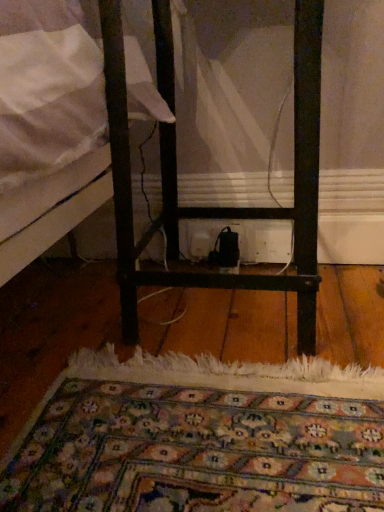
Question: Can you confirm if black metal nightstand at center is bigger than white plastic electric outlet at center?

Choices:
 (A) yes
 (B) no

Answer: (A)

Question: Does black metal nightstand at center have a greater width compared to white plastic electric outlet at center?

Choices:
 (A) no
 (B) yes

Answer: (B)

Question: Is black metal nightstand at center surrounding white plastic electric outlet at center?

Choices:
 (A) yes
 (B) no

Answer: (A)

Question: Is black metal nightstand at center shorter than white plastic electric outlet at center?

Choices:
 (A) yes
 (B) no

Answer: (B)

Question: Considering the relative positions of black metal nightstand at center and white plastic electric outlet at center in the image provided, is black metal nightstand at center in front of white plastic electric outlet at center?

Choices:
 (A) no
 (B) yes

Answer: (B)

Question: Is there a large distance between black metal nightstand at center and white plastic electric outlet at center?

Choices:
 (A) no
 (B) yes

Answer: (A)

Question: From a real-world perspective, is carpeted rug at center physically below black metal nightstand at center?

Choices:
 (A) no
 (B) yes

Answer: (B)

Question: Does carpeted rug at center come behind black metal nightstand at center?

Choices:
 (A) no
 (B) yes

Answer: (A)

Question: Does carpeted rug at center come in front of black metal nightstand at center?

Choices:
 (A) no
 (B) yes

Answer: (B)

Question: Is carpeted rug at center next to black metal nightstand at center and touching it?

Choices:
 (A) yes
 (B) no

Answer: (B)

Question: Is carpeted rug at center facing towards black metal nightstand at center?

Choices:
 (A) yes
 (B) no

Answer: (A)

Question: Is carpeted rug at center shorter than black metal nightstand at center?

Choices:
 (A) no
 (B) yes

Answer: (B)

Question: Would you say carpeted rug at center is part of black metal nightstand at center's contents?

Choices:
 (A) yes
 (B) no

Answer: (B)